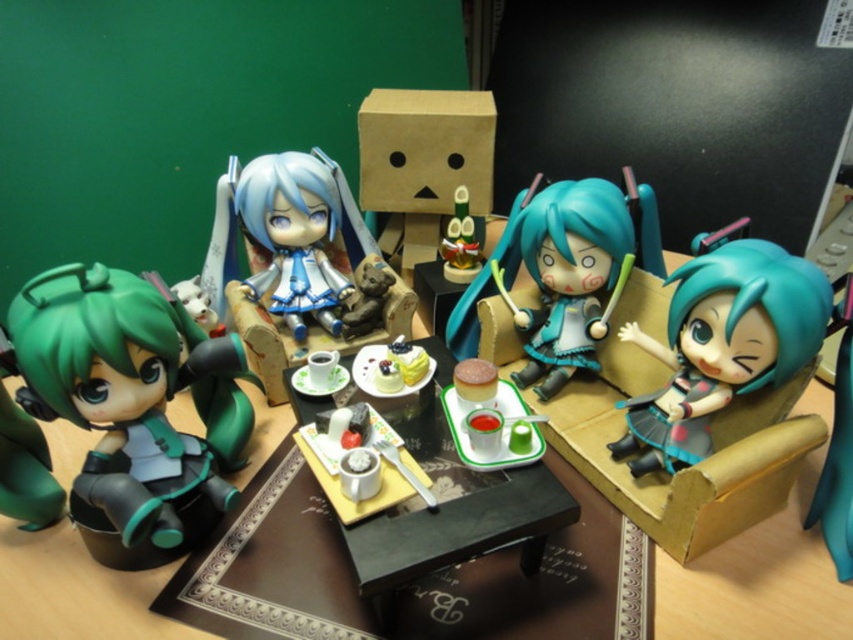
Is teal matte figure at center thinner than matte blue fabric doll at center?

No.

Can you confirm if teal matte figure at center is bigger than matte blue fabric doll at center?

Yes.

Who is more distant from viewer, (556, 193) or (300, 202)?

The point (300, 202) is behind.

Identify the location of teal matte figure at center. (563, 273).

Can you confirm if black plastic table at center is bigger than white plush cat at left?

Yes, black plastic table at center is bigger than white plush cat at left.

Is point (524, 536) positioned before point (201, 291)?

Yes, point (524, 536) is in front of point (201, 291).

Is point (368, 595) more distant than point (199, 291)?

No, it is not.

Identify the location of black plastic table at center. The image size is (853, 640). (451, 513).

From the picture: Is teal matte figure at center above white plush cat at left?

Indeed, teal matte figure at center is positioned over white plush cat at left.

This screenshot has height=640, width=853. In order to click on teal matte figure at center in this screenshot , I will do `click(563, 273)`.

What do you see at coordinates (563, 273) in the screenshot?
I see `teal matte figure at center` at bounding box center [563, 273].

The width and height of the screenshot is (853, 640). Identify the location of teal matte figure at center. (563, 273).